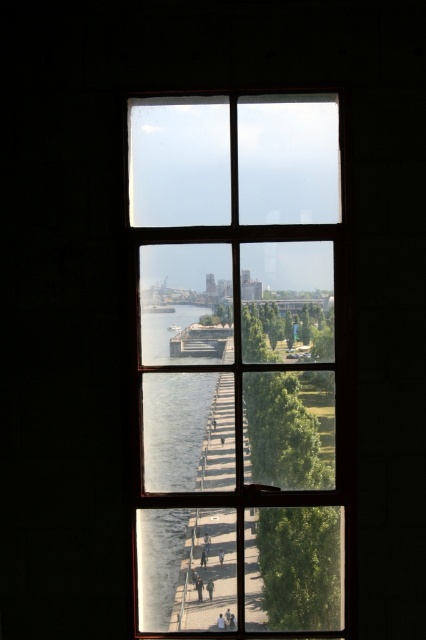
You are standing in a room and want to open the wooden window at center. Considering the window is at a height of 1.8 meters from the floor, can you reach it comfortably?

The wooden window at center is 4.76 meters away from the viewer. Since the window is 1.8 meters high, a typical adult can comfortably reach it without needing a stool or ladder.

You are an architect designing a new building and want to ensure that the wooden window at center provides a clear view of the clear glass waterway at center. Based on their sizes, can the window accommodate the waterway in its frame?

The wooden window at center might be wider than clear glass waterway at center, so it could potentially accommodate the waterway within its frame, as the window may have sufficient width to encompass the narrower waterway.

You are standing in a room and looking through the wooden window at center and the clear glass waterway at center. Which object shows the pathway bordered by trees and water?

The clear glass waterway at center shows the pathway bordered by trees and water because the wooden window at center is positioned on its right side, indicating their spatial arrangement.